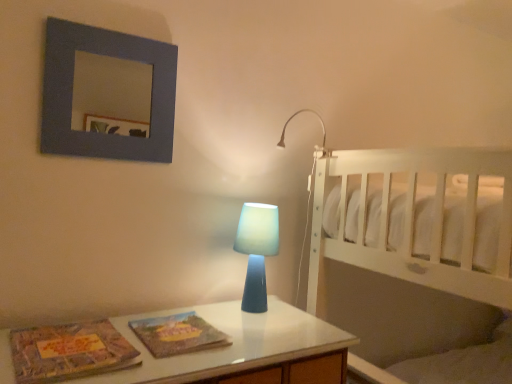
The height and width of the screenshot is (384, 512). I want to click on matte cardboard magazine at lower left, which appears as the 1th magazine when viewed from the left, so click(x=69, y=352).

Locate an element on the screen. Image resolution: width=512 pixels, height=384 pixels. white wooden bed at right is located at coordinates (408, 251).

Describe the element at coordinates (257, 251) in the screenshot. I see `blue translucent lamp at center, the 1th lamp positioned from the left` at that location.

Identify the location of blue translucent lamp at center, the 1th lamp positioned from the left. (257, 251).

What do you see at coordinates (178, 334) in the screenshot?
I see `textured paper magazine at center, which appears as the first magazine when viewed from the right` at bounding box center [178, 334].

Locate an element on the screen. Image resolution: width=512 pixels, height=384 pixels. matte cardboard magazine at lower left, which appears as the 1th magazine when viewed from the left is located at coordinates (69, 352).

Locate an element on the screen. This screenshot has width=512, height=384. magazine that is the 2nd object to the left of the blue translucent lamp at upper right, which appears as the second lamp when viewed from the left, starting at the anchor is located at coordinates (69, 352).

Is matte cardboard magazine at lower left, which is the second magazine from right to left, far away from blue translucent lamp at upper right, which is the second lamp from bottom to top?

No, matte cardboard magazine at lower left, which is the second magazine from right to left, is not far from blue translucent lamp at upper right, which is the second lamp from bottom to top.

Is matte cardboard magazine at lower left, which appears as the 1th magazine when viewed from the left, positioned with its back to blue translucent lamp at upper right, which appears as the second lamp when viewed from the left?

No, matte cardboard magazine at lower left, which appears as the 1th magazine when viewed from the left, is not facing the opposite direction of blue translucent lamp at upper right, which appears as the second lamp when viewed from the left.

Considering the sizes of objects matte cardboard magazine at lower left, which is the second magazine from right to left, and blue translucent lamp at upper right, which is the first lamp from top to bottom, in the image provided, who is taller, matte cardboard magazine at lower left, which is the second magazine from right to left, or blue translucent lamp at upper right, which is the first lamp from top to bottom,?

Standing taller between the two is blue translucent lamp at upper right, which is the first lamp from top to bottom.

From the image's perspective, is blue translucent lamp at center, the 1th lamp positioned from the left, above textured paper magazine at center, which appears as the first magazine when viewed from the right?

Yes, from the image's perspective, blue translucent lamp at center, the 1th lamp positioned from the left, is on top of textured paper magazine at center, which appears as the first magazine when viewed from the right.

Does point (261, 222) appear closer or farther from the camera than point (217, 345)?

Point (261, 222) is positioned farther from the camera compared to point (217, 345).

Which of these two, blue translucent lamp at center, which ranks as the second lamp in right-to-left order, or textured paper magazine at center, which appears as the first magazine when viewed from the right, is smaller?

textured paper magazine at center, which appears as the first magazine when viewed from the right, is smaller.

Looking at this image, from a real-world perspective, is blue translucent lamp at center, marked as the 2th lamp in a top-to-bottom arrangement, physically below textured paper magazine at center, which appears as the first magazine when viewed from the right?

No, from a real-world perspective, blue translucent lamp at center, marked as the 2th lamp in a top-to-bottom arrangement, is not beneath textured paper magazine at center, which appears as the first magazine when viewed from the right.

Is matte cardboard magazine at lower left, which appears as the 1th magazine when viewed from the left, in front of textured paper magazine at center, which appears as the first magazine when viewed from the right?

Yes, the depth of matte cardboard magazine at lower left, which appears as the 1th magazine when viewed from the left, is less than that of textured paper magazine at center, which appears as the first magazine when viewed from the right.

Is textured paper magazine at center, placed as the second magazine when sorted from left to right, a part of matte cardboard magazine at lower left, which is the second magazine from right to left?

No, textured paper magazine at center, placed as the second magazine when sorted from left to right, is located outside of matte cardboard magazine at lower left, which is the second magazine from right to left.

Is matte cardboard magazine at lower left, which appears as the 1th magazine when viewed from the left, beside textured paper magazine at center, which appears as the first magazine when viewed from the right?

matte cardboard magazine at lower left, which appears as the 1th magazine when viewed from the left, and textured paper magazine at center, which appears as the first magazine when viewed from the right, are not in contact.

Considering the positions of points (121, 352) and (170, 348), is point (121, 352) farther from camera compared to point (170, 348)?

No, (121, 352) is in front of (170, 348).

Is blue translucent lamp at upper right, which is the second lamp from bottom to top, far away from blue translucent lamp at center, the 1th lamp ordered from the bottom?

No, blue translucent lamp at upper right, which is the second lamp from bottom to top, is not far away from blue translucent lamp at center, the 1th lamp ordered from the bottom.

Between blue translucent lamp at upper right, acting as the 1th lamp starting from the right, and blue translucent lamp at center, marked as the 2th lamp in a top-to-bottom arrangement, which one has larger size?

With larger size is blue translucent lamp at center, marked as the 2th lamp in a top-to-bottom arrangement.

Which object is further away from the camera, blue translucent lamp at upper right, acting as the 1th lamp starting from the right, or blue translucent lamp at center, the 1th lamp ordered from the bottom?

blue translucent lamp at upper right, acting as the 1th lamp starting from the right, is more distant.

Find the location of a particular element. lamp below the blue translucent lamp at upper right, which appears as the second lamp when viewed from the left (from a real-world perspective) is located at coordinates (257, 251).

From a real-world perspective, is white wooden bed at right over textured paper magazine at center, placed as the second magazine when sorted from left to right?

Indeed, from a real-world perspective, white wooden bed at right stands above textured paper magazine at center, placed as the second magazine when sorted from left to right.

Considering the sizes of objects white wooden bed at right and textured paper magazine at center, placed as the second magazine when sorted from left to right, in the image provided, who is wider, white wooden bed at right or textured paper magazine at center, placed as the second magazine when sorted from left to right,?

white wooden bed at right.

Could you tell me if white wooden bed at right is turned towards textured paper magazine at center, placed as the second magazine when sorted from left to right?

Yes, white wooden bed at right is facing textured paper magazine at center, placed as the second magazine when sorted from left to right.

Does matte gray picture frame at upper left have a lesser width compared to textured paper magazine at center, placed as the second magazine when sorted from left to right?

Correct, the width of matte gray picture frame at upper left is less than that of textured paper magazine at center, placed as the second magazine when sorted from left to right.

Considering the positions of points (82, 154) and (150, 346), is point (82, 154) farther from camera compared to point (150, 346)?

That is True.

From a real-world perspective, is matte gray picture frame at upper left physically above textured paper magazine at center, which appears as the first magazine when viewed from the right?

Yes.

Locate an element on the screen. picture frame above the textured paper magazine at center, placed as the second magazine when sorted from left to right (from the image's perspective) is located at coordinates (106, 94).

How different are the orientations of blue translucent lamp at center, marked as the 2th lamp in a top-to-bottom arrangement, and matte gray picture frame at upper left in degrees?

They differ by 0.00379 degrees in their facing directions.

From a real-world perspective, which is physically below, blue translucent lamp at center, marked as the 2th lamp in a top-to-bottom arrangement, or matte gray picture frame at upper left?

blue translucent lamp at center, marked as the 2th lamp in a top-to-bottom arrangement, from a real-world perspective.

Is blue translucent lamp at center, marked as the 2th lamp in a top-to-bottom arrangement, turned away from matte gray picture frame at upper left?

No.

Are blue translucent lamp at center, the 1th lamp ordered from the bottom, and matte gray picture frame at upper left making contact?

blue translucent lamp at center, the 1th lamp ordered from the bottom, and matte gray picture frame at upper left are not in contact.

The image size is (512, 384). What are the coordinates of `the 1st magazine below the blue translucent lamp at upper right, acting as the 1th lamp starting from the right (from a real-world perspective)` in the screenshot? It's located at (69, 352).

Starting from the blue translucent lamp at center, the 1th lamp positioned from the left, which magazine is the 1st one in front? Please provide its 2D coordinates.

[(178, 334)]

Based on their spatial positions, is matte gray picture frame at upper left or blue translucent lamp at center, marked as the 2th lamp in a top-to-bottom arrangement, further from blue translucent lamp at upper right, which appears as the second lamp when viewed from the left?

matte gray picture frame at upper left.

When comparing their distances from matte gray picture frame at upper left, does white wooden bed at right or matte cardboard magazine at lower left, which appears as the 1th magazine when viewed from the left, seem further?

The object further to matte gray picture frame at upper left is matte cardboard magazine at lower left, which appears as the 1th magazine when viewed from the left.

Based on their spatial positions, is blue translucent lamp at center, the 1th lamp ordered from the bottom, or blue translucent lamp at upper right, which appears as the second lamp when viewed from the left, closer to textured paper magazine at center, placed as the second magazine when sorted from left to right?

blue translucent lamp at center, the 1th lamp ordered from the bottom, is positioned closer to the anchor textured paper magazine at center, placed as the second magazine when sorted from left to right.

From the image, which object appears to be nearer to textured paper magazine at center, placed as the second magazine when sorted from left to right, matte cardboard magazine at lower left, which appears as the 1th magazine when viewed from the left, or blue translucent lamp at upper right, which appears as the second lamp when viewed from the left?

matte cardboard magazine at lower left, which appears as the 1th magazine when viewed from the left, is closer to textured paper magazine at center, placed as the second magazine when sorted from left to right.

From the image, which object appears to be farther from textured paper magazine at center, placed as the second magazine when sorted from left to right, blue translucent lamp at upper right, which is the first lamp from top to bottom, or matte gray picture frame at upper left?

matte gray picture frame at upper left is positioned further to the anchor textured paper magazine at center, placed as the second magazine when sorted from left to right.

When comparing their distances from white wooden bed at right, does blue translucent lamp at center, which ranks as the second lamp in right-to-left order, or matte cardboard magazine at lower left, which is the second magazine from right to left, seem closer?

blue translucent lamp at center, which ranks as the second lamp in right-to-left order, is positioned closer to the anchor white wooden bed at right.

Based on their spatial positions, is matte cardboard magazine at lower left, which is the second magazine from right to left, or white wooden bed at right further from blue translucent lamp at upper right, which is the second lamp from bottom to top?

matte cardboard magazine at lower left, which is the second magazine from right to left, is further to blue translucent lamp at upper right, which is the second lamp from bottom to top.

Estimate the real-world distances between objects in this image. Which object is further from white wooden bed at right, matte gray picture frame at upper left or blue translucent lamp at upper right, which is the first lamp from top to bottom?

The object further to white wooden bed at right is matte gray picture frame at upper left.

Where is `magazine located between matte gray picture frame at upper left and white wooden bed at right in the left-right direction`? The height and width of the screenshot is (384, 512). magazine located between matte gray picture frame at upper left and white wooden bed at right in the left-right direction is located at coordinates (178, 334).

The width and height of the screenshot is (512, 384). What are the coordinates of `lamp between blue translucent lamp at center, the 1th lamp ordered from the bottom, and white wooden bed at right` in the screenshot? It's located at (292, 118).

Find the location of a particular element. The width and height of the screenshot is (512, 384). lamp between matte cardboard magazine at lower left, which appears as the 1th magazine when viewed from the left, and blue translucent lamp at upper right, which appears as the second lamp when viewed from the left, from left to right is located at coordinates (257, 251).

This screenshot has width=512, height=384. I want to click on lamp situated between matte gray picture frame at upper left and blue translucent lamp at upper right, which is the second lamp from bottom to top, from left to right, so click(257, 251).